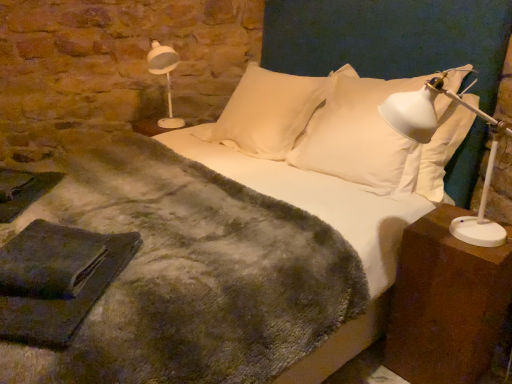
In order to face white soft pillow at center, the first pillow from the left, should I rotate leftwards or rightwards?

To align with it, rotate right about 2.311°.

The image size is (512, 384). What do you see at coordinates (430, 141) in the screenshot?
I see `white plastic table lamp at right` at bounding box center [430, 141].

Measure the distance between point [450,100] and camera.

The depth of point [450,100] is 6.07 feet.

This screenshot has height=384, width=512. Identify the location of brown wooden nightstand at right. [446, 303].

From a real-world perspective, which is physically below, white soft pillow at upper center, which is the 1th pillow in right-to-left order, or white plastic lamp at upper left?

In real-world perspective, white soft pillow at upper center, which is the 1th pillow in right-to-left order, is lower.

Which of these two, white soft pillow at upper center, which is the 1th pillow in right-to-left order, or white plastic lamp at upper left, stands shorter?

white plastic lamp at upper left is shorter.

Which is in front, white soft pillow at upper center, which is the 1th pillow in right-to-left order, or white plastic lamp at upper left?

white soft pillow at upper center, which is the 1th pillow in right-to-left order, is closer to the camera.

Is white soft pillow at upper center, which is the 1th pillow in right-to-left order, outside of white plastic lamp at upper left?

Yes, white soft pillow at upper center, which is the 1th pillow in right-to-left order, is located beyond the bounds of white plastic lamp at upper left.

Does white soft pillow at center, the first pillow from the left, have a greater height compared to white plastic table lamp at right?

Yes.

From a real-world perspective, is white soft pillow at center, the first pillow from the left, over white plastic table lamp at right?

Actually, white soft pillow at center, the first pillow from the left, is physically below white plastic table lamp at right in the real world.

Is white soft pillow at center, acting as the 2th pillow starting from the right, not inside white plastic table lamp at right?

Yes.

Can you confirm if white soft pillow at upper center, which is the 1th pillow in right-to-left order, is positioned to the right of white soft pillow at center, acting as the 2th pillow starting from the right?

Correct, you'll find white soft pillow at upper center, which is the 1th pillow in right-to-left order, to the right of white soft pillow at center, acting as the 2th pillow starting from the right.

From a real-world perspective, does white soft pillow at upper center, which is the 1th pillow in right-to-left order, stand above white soft pillow at center, the first pillow from the left?

Yes, from a real-world perspective, white soft pillow at upper center, which is the 1th pillow in right-to-left order, is above white soft pillow at center, the first pillow from the left.

Based on the photo, considering the relative sizes of white soft pillow at upper center, which is the 1th pillow in right-to-left order, and white soft pillow at center, acting as the 2th pillow starting from the right, in the image provided, is white soft pillow at upper center, which is the 1th pillow in right-to-left order, smaller than white soft pillow at center, acting as the 2th pillow starting from the right,?

Incorrect, white soft pillow at upper center, which is the 1th pillow in right-to-left order, is not smaller in size than white soft pillow at center, acting as the 2th pillow starting from the right.

Considering the relative sizes of white plastic lamp at upper left and brown wooden nightstand at right in the image provided, is white plastic lamp at upper left smaller than brown wooden nightstand at right?

Correct, white plastic lamp at upper left occupies less space than brown wooden nightstand at right.

From a real-world perspective, relative to brown wooden nightstand at right, is white plastic lamp at upper left vertically above or below?

Clearly, from a real-world perspective, white plastic lamp at upper left is above brown wooden nightstand at right.

Measure the distance from white plastic lamp at upper left to brown wooden nightstand at right.

6.05 feet.

Can we say white plastic lamp at upper left lies outside brown wooden nightstand at right?

That's correct, white plastic lamp at upper left is outside of brown wooden nightstand at right.

Which object is positioned more to the left, white soft pillow at center, the first pillow from the left, or brown wooden nightstand at right?

From the viewer's perspective, white soft pillow at center, the first pillow from the left, appears more on the left side.

From the image's perspective, is white soft pillow at center, the first pillow from the left, positioned above or below brown wooden nightstand at right?

Based on their image positions, white soft pillow at center, the first pillow from the left, is located above brown wooden nightstand at right.

In terms of width, does white soft pillow at center, the first pillow from the left, look wider or thinner when compared to brown wooden nightstand at right?

Clearly, white soft pillow at center, the first pillow from the left, has more width compared to brown wooden nightstand at right.

From a real-world perspective, which object rests below the other?

brown wooden nightstand at right is physically lower.

Is white plastic table lamp at right oriented towards brown wooden nightstand at right?

No, white plastic table lamp at right is not oriented towards brown wooden nightstand at right.

Can you confirm if white plastic table lamp at right is smaller than brown wooden nightstand at right?

No.

Based on the photo, how distant is white plastic table lamp at right from brown wooden nightstand at right?

They are 11.61 inches apart.

Considering the relative positions of white plastic table lamp at right and brown wooden nightstand at right in the image provided, is white plastic table lamp at right behind brown wooden nightstand at right?

No, white plastic table lamp at right is closer to the viewer.

From a real-world perspective, which object rests below the other?

brown wooden nightstand at right is physically lower.

Is brown wooden nightstand at right not inside white soft pillow at upper center, which is the 1th pillow in right-to-left order?

Absolutely, brown wooden nightstand at right is external to white soft pillow at upper center, which is the 1th pillow in right-to-left order.

Looking at their sizes, would you say brown wooden nightstand at right is wider or thinner than white soft pillow at upper center, marked as the 2th pillow in a left-to-right arrangement?

brown wooden nightstand at right is thinner than white soft pillow at upper center, marked as the 2th pillow in a left-to-right arrangement.

Starting from the white plastic lamp at upper left, which pillow is the 2nd one in front? Please provide its 2D coordinates.

[(378, 139)]

Identify the location of table lamp that appears above the white soft pillow at center, acting as the 2th pillow starting from the right (from a real-world perspective). (430, 141).

Looking at the image, which one is located further to brown wooden nightstand at right, white soft pillow at center, the first pillow from the left, or white plastic lamp at upper left?

white plastic lamp at upper left.

Considering their positions, is white soft pillow at center, the first pillow from the left, positioned further to white plastic table lamp at right than white plastic lamp at upper left?

Based on the image, white plastic lamp at upper left appears to be further to white plastic table lamp at right.

Estimate the real-world distances between objects in this image. Which object is further from white soft pillow at upper center, which is the 1th pillow in right-to-left order, white soft pillow at center, acting as the 2th pillow starting from the right, or white plastic lamp at upper left?

white plastic lamp at upper left.

Considering their positions, is brown wooden nightstand at right positioned closer to white plastic table lamp at right than white soft pillow at upper center, which is the 1th pillow in right-to-left order?

Among the two, brown wooden nightstand at right is located nearer to white plastic table lamp at right.

Which object lies nearer to the anchor point white plastic lamp at upper left, brown wooden nightstand at right or white soft pillow at center, acting as the 2th pillow starting from the right?

Based on the image, white soft pillow at center, acting as the 2th pillow starting from the right, appears to be nearer to white plastic lamp at upper left.

Based on their spatial positions, is white plastic table lamp at right or white plastic lamp at upper left closer to brown wooden nightstand at right?

Among the two, white plastic table lamp at right is located nearer to brown wooden nightstand at right.

Looking at this image, which object lies nearer to the anchor point white soft pillow at upper center, marked as the 2th pillow in a left-to-right arrangement, brown wooden nightstand at right or white plastic table lamp at right?

white plastic table lamp at right lies closer to white soft pillow at upper center, marked as the 2th pillow in a left-to-right arrangement, than the other object.

Estimate the real-world distances between objects in this image. Which object is further from white plastic table lamp at right, white soft pillow at center, acting as the 2th pillow starting from the right, or white soft pillow at upper center, which is the 1th pillow in right-to-left order?

The object further to white plastic table lamp at right is white soft pillow at center, acting as the 2th pillow starting from the right.

I want to click on pillow between white plastic lamp at upper left and white soft pillow at upper center, which is the 1th pillow in right-to-left order, so click(269, 111).

Locate an element on the screen. Image resolution: width=512 pixels, height=384 pixels. pillow between white plastic table lamp at right and white soft pillow at center, the first pillow from the left, in the front-back direction is located at coordinates (378, 139).

The height and width of the screenshot is (384, 512). Find the location of `pillow between white soft pillow at center, acting as the 2th pillow starting from the right, and brown wooden nightstand at right in the up-down direction`. pillow between white soft pillow at center, acting as the 2th pillow starting from the right, and brown wooden nightstand at right in the up-down direction is located at coordinates (378, 139).

Identify the location of table lamp between white soft pillow at upper center, marked as the 2th pillow in a left-to-right arrangement, and brown wooden nightstand at right from top to bottom. (430, 141).